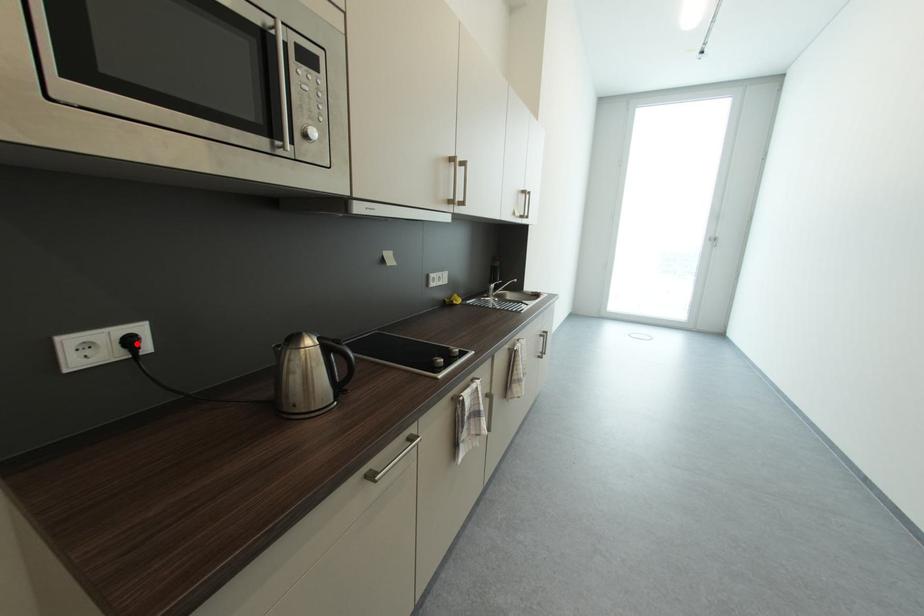
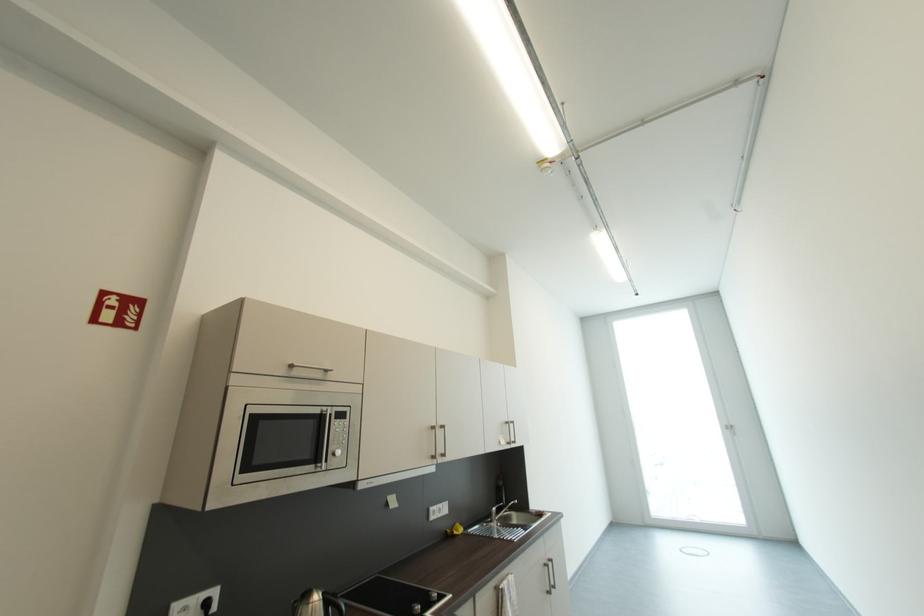
Where in the second image is the point corresponding to the highlighted location from the first image?

(213, 605)